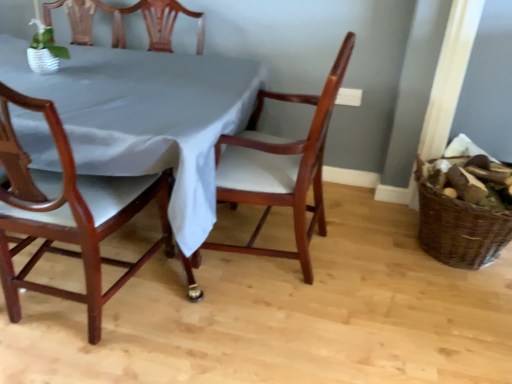
Question: In the image, is mahogany wood chair at center, the second chair when ordered from left to right, on the left side or the right side of satin white tablecloth at center?

Choices:
 (A) right
 (B) left

Answer: (A)

Question: Is mahogany wood chair at center, the 1th chair in the right-to-left sequence, wider or thinner than satin white tablecloth at center?

Choices:
 (A) thin
 (B) wide

Answer: (A)

Question: Based on their relative distances, which object is farther from the satin white tablecloth at center?

Choices:
 (A) mahogany wood chair at center, the 1th chair in the right-to-left sequence
 (B) brown woven basket at right
 (C) mahogany wood chair at left, the second chair in the right-to-left sequence

Answer: (B)

Question: Which object is positioned closest to the brown woven basket at right?

Choices:
 (A) mahogany wood chair at center, the second chair when ordered from left to right
 (B) mahogany wood chair at left, the second chair in the right-to-left sequence
 (C) satin white tablecloth at center

Answer: (A)